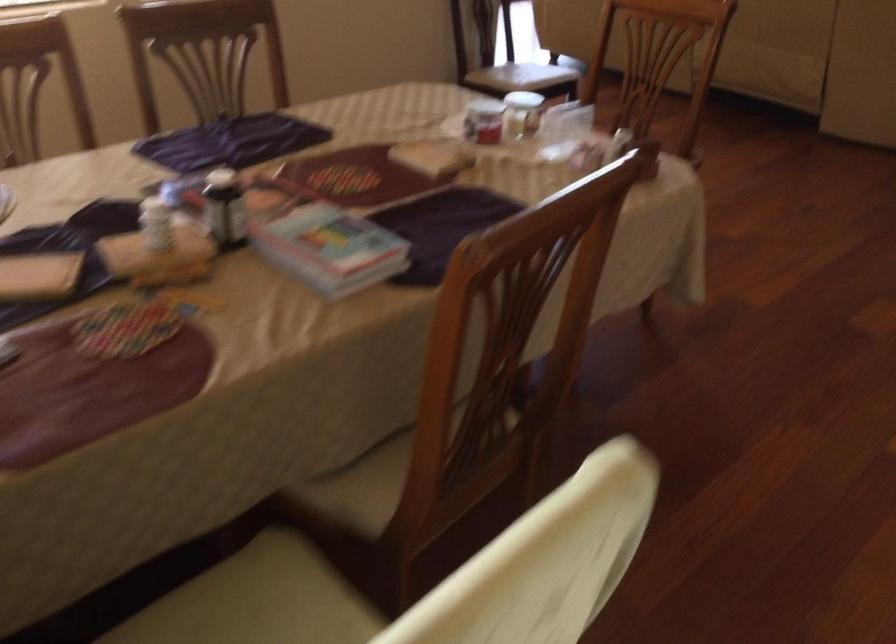
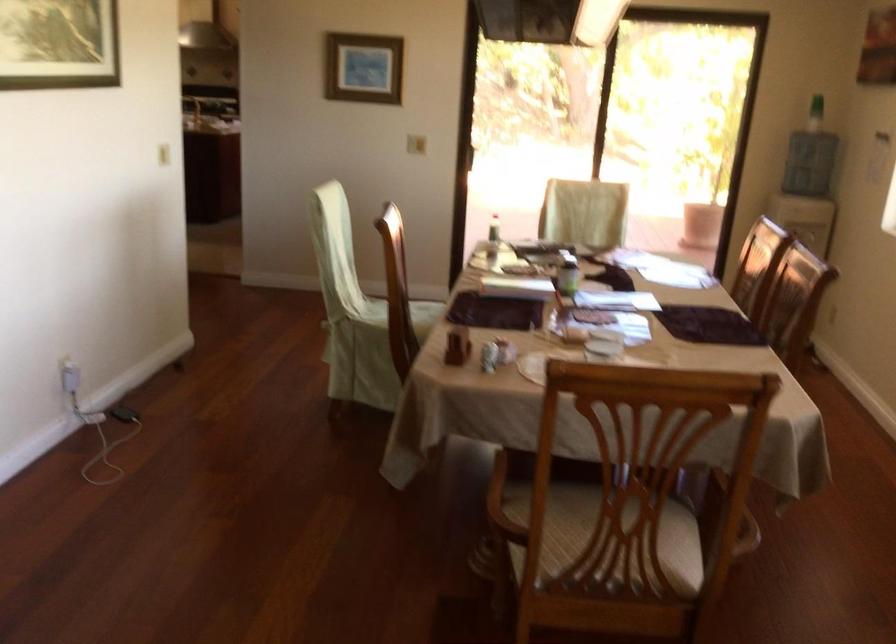
Where in the second image is the point corresponding to point (247, 210) from the first image?

(566, 272)